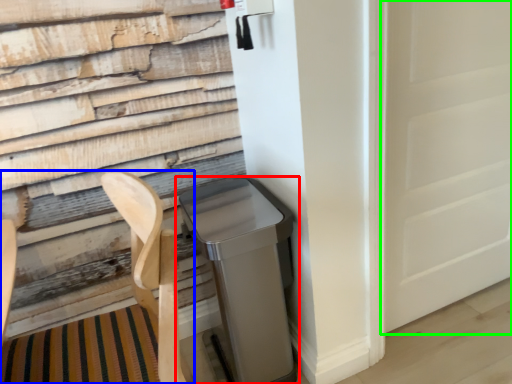
Question: Which is farther away from waste container (highlighted by a red box)? folding chair (highlighted by a blue box) or screen door (highlighted by a green box)?

Choices:
 (A) folding chair
 (B) screen door

Answer: (B)